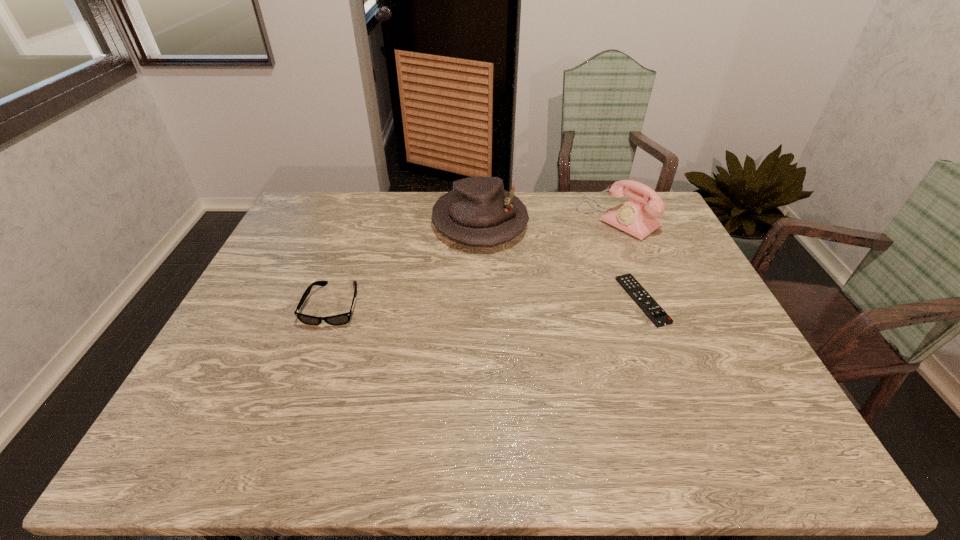
Find the location of a particular element. vacant area located 0.320m on the dial of the telephone is located at coordinates (528, 279).

The image size is (960, 540). I want to click on vacant space situated 0.160m on the dial of the telephone, so click(564, 255).

At what (x,y) coordinates should I click in order to perform the action: click on free location located 0.170m on the dial of the telephone. Please return your answer as a coordinate pair (x, y). The image size is (960, 540). Looking at the image, I should click on (562, 256).

Find the location of a particular element. hat at the far edge is located at coordinates (478, 211).

At what (x,y) coordinates should I click in order to perform the action: click on telephone situated at the far edge. Please return your answer as a coordinate pair (x, y). Looking at the image, I should click on (633, 217).

This screenshot has height=540, width=960. I want to click on remote control situated at the right edge, so click(x=634, y=289).

Identify the location of telephone that is at the right edge. Image resolution: width=960 pixels, height=540 pixels. (633, 217).

Locate an element on the screen. object that is at the far right corner is located at coordinates (633, 217).

This screenshot has width=960, height=540. What are the coordinates of `free space at the far edge of the desktop` in the screenshot? It's located at (569, 202).

Image resolution: width=960 pixels, height=540 pixels. What are the coordinates of `free space at the near edge of the desktop` in the screenshot? It's located at (374, 397).